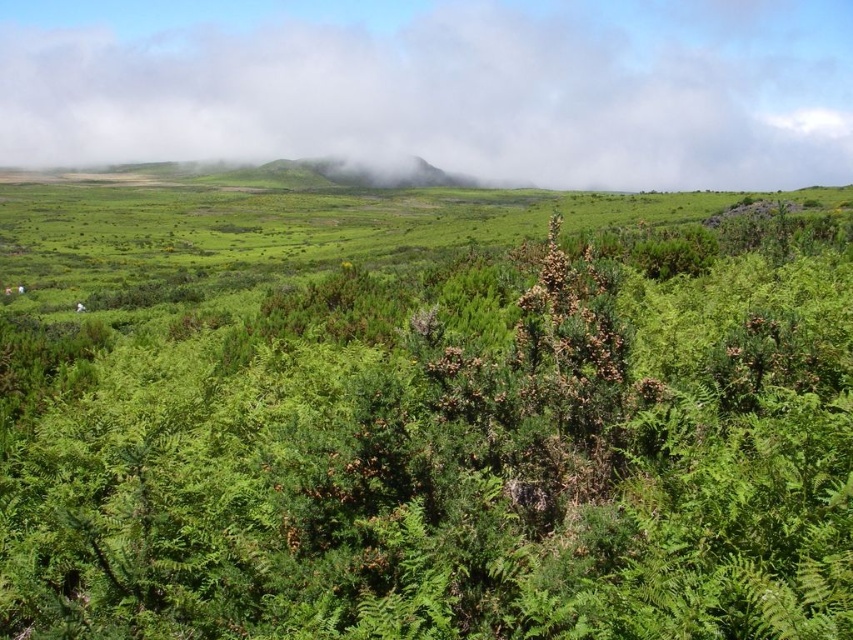
Measure the distance between green leafy shrub at center and white fluffy cloud at upper center.

1026.85 feet

Can you confirm if green leafy shrub at center is positioned to the right of white fluffy cloud at upper center?

Incorrect, green leafy shrub at center is not on the right side of white fluffy cloud at upper center.

Describe the element at coordinates (456, 456) in the screenshot. I see `green leafy shrub at center` at that location.

The width and height of the screenshot is (853, 640). What are the coordinates of `green leafy shrub at center` in the screenshot? It's located at (456, 456).